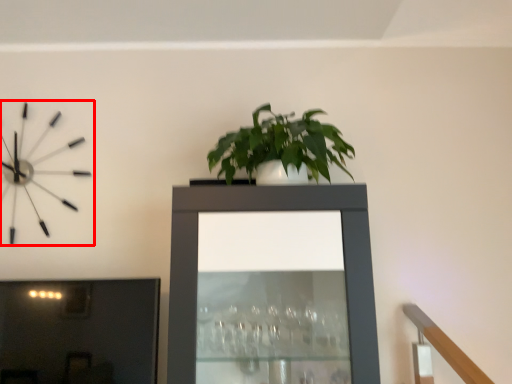
Question: Where is wall clock (annotated by the red box) located in relation to tv cabinet in the image?

Choices:
 (A) left
 (B) right

Answer: (A)